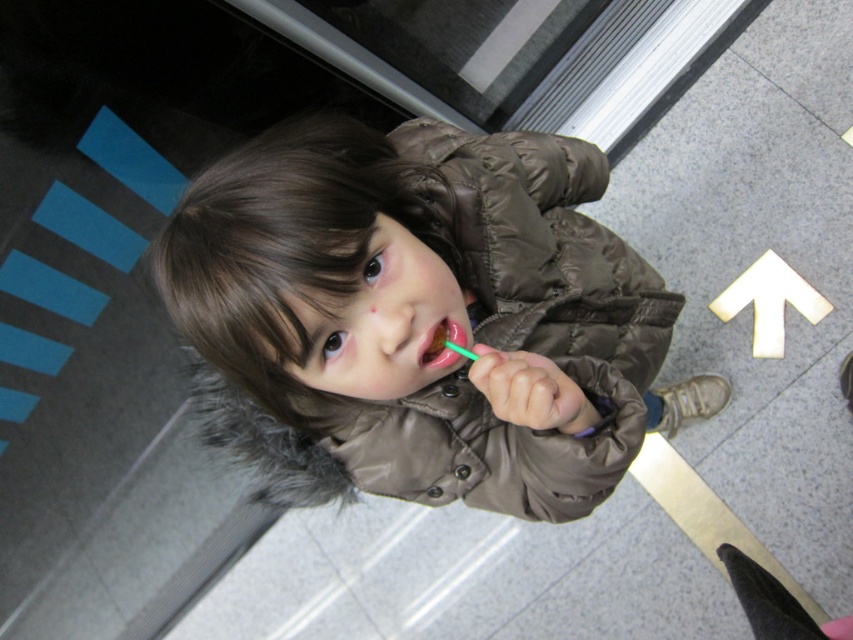
Question: Does brown puffy coat at center have a lesser width compared to green plastic toothbrush at center?

Choices:
 (A) no
 (B) yes

Answer: (A)

Question: Among these objects, which one is nearest to the camera?

Choices:
 (A) green plastic toothbrush at center
 (B) brown puffy coat at center

Answer: (B)

Question: Among these objects, which one is farthest from the camera?

Choices:
 (A) green plastic toothbrush at center
 (B) brown puffy coat at center

Answer: (A)

Question: Can you confirm if brown puffy coat at center is bigger than green plastic toothbrush at center?

Choices:
 (A) no
 (B) yes

Answer: (B)

Question: Among these objects, which one is nearest to the camera?

Choices:
 (A) brown puffy coat at center
 (B) green plastic toothbrush at center

Answer: (A)

Question: Where is brown puffy coat at center located in relation to green plastic toothbrush at center in the image?

Choices:
 (A) left
 (B) right

Answer: (B)